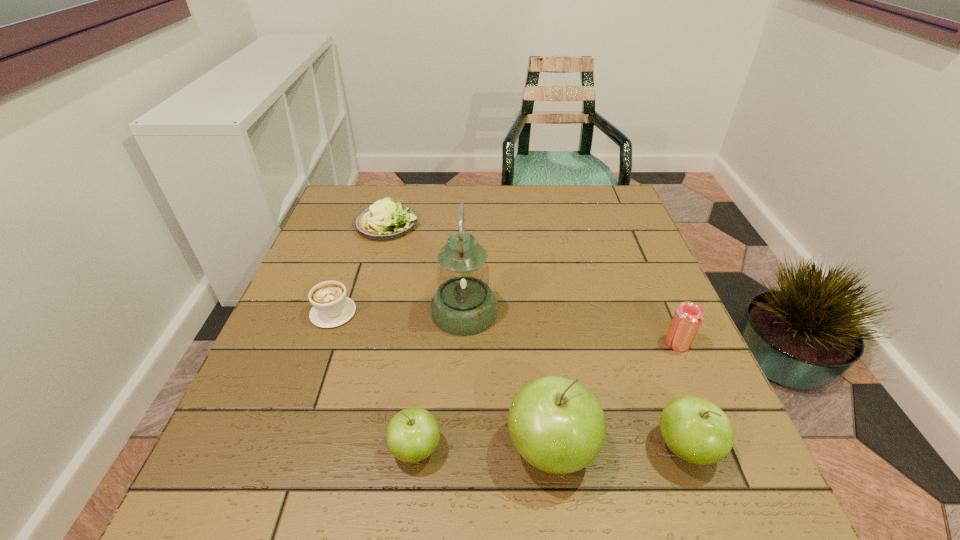
In the image, there is a desktop. Find the location of `vacant space at the far right corner`. vacant space at the far right corner is located at coordinates (623, 194).

Identify the location of vacant area that lies between the second shortest apple and the cappuccino. The width and height of the screenshot is (960, 540). (510, 379).

Locate an element on the screen. The height and width of the screenshot is (540, 960). unoccupied area between the beer can and the farthest object is located at coordinates (532, 284).

What are the coordinates of `free space that is in between the beer can and the farthest object` in the screenshot? It's located at (532, 284).

The width and height of the screenshot is (960, 540). What are the coordinates of `vacant point located between the second tallest apple and the beer can` in the screenshot? It's located at (682, 395).

Find the location of `free space between the shortest apple and the farthest object`. free space between the shortest apple and the farthest object is located at coordinates (401, 336).

The width and height of the screenshot is (960, 540). I want to click on empty location between the second tallest apple and the cappuccino, so pyautogui.click(x=510, y=379).

The width and height of the screenshot is (960, 540). Find the location of `free space between the beer can and the sixth shortest object`. free space between the beer can and the sixth shortest object is located at coordinates (x=614, y=395).

Locate an element on the screen. unoccupied position between the second apple from left to right and the cappuccino is located at coordinates (443, 380).

This screenshot has height=540, width=960. What are the coordinates of `free space between the farthest object and the lantern` in the screenshot? It's located at (425, 268).